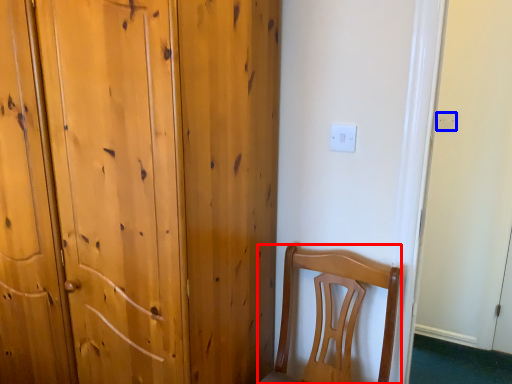
Question: Among these objects, which one is farthest to the camera, chair (highlighted by a red box) or electric outlet (highlighted by a blue box)?

Choices:
 (A) chair
 (B) electric outlet

Answer: (B)